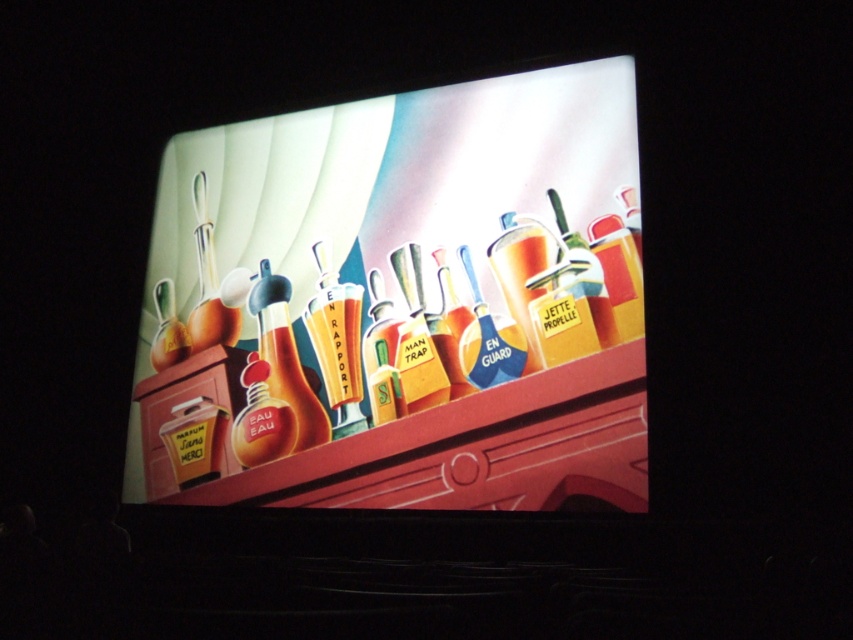
Which is behind, point (479, 106) or point (500, 332)?

The point (479, 106) is more distant.

Is the position of shiny plastic bottles at center more distant than that of blue glass bottle at center?

No.

What do you see at coordinates (401, 298) in the screenshot? The height and width of the screenshot is (640, 853). I see `shiny plastic bottles at center` at bounding box center [401, 298].

You are a GUI agent. You are given a task and a screenshot of the screen. Output one action in this format:
    pyautogui.click(x=<x>, y=<y>)
    Task: Click on the shiny plastic bottles at center
    The image size is (853, 640).
    Given the screenshot: What is the action you would take?
    pyautogui.click(x=401, y=298)

Does matte glass bottle at center have a lesser height compared to yellow matte bottle at center?

No, matte glass bottle at center is not shorter than yellow matte bottle at center.

Who is higher up, matte glass bottle at center or yellow matte bottle at center?

yellow matte bottle at center is higher up.

Is point (267, 262) positioned behind point (405, 384)?

Yes, point (267, 262) is farther from viewer.

Image resolution: width=853 pixels, height=640 pixels. I want to click on matte glass bottle at center, so click(285, 356).

Can you confirm if matte glass spray can at center is positioned to the right of matte glass perfume bottle at center?

Correct, you'll find matte glass spray can at center to the right of matte glass perfume bottle at center.

Who is shorter, matte glass spray can at center or matte glass perfume bottle at center?

matte glass perfume bottle at center

Where is `matte glass spray can at center`? The image size is (853, 640). matte glass spray can at center is located at coordinates (381, 355).